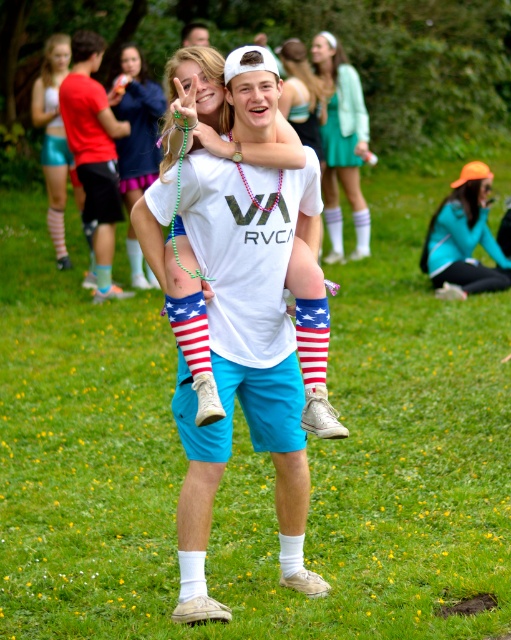
Question: Does white cotton t-shirt at center have a larger size compared to orange fabric hat at upper right?

Choices:
 (A) yes
 (B) no

Answer: (A)

Question: Which object is closer to the camera taking this photo?

Choices:
 (A) matte white t-shirt at center
 (B) white cotton t-shirt at center
 (C) shiny teal shorts at upper left
 (D) matte red shorts at upper left

Answer: (B)

Question: Is orange fabric hat at upper right bigger than matte white shirt at center?

Choices:
 (A) yes
 (B) no

Answer: (B)

Question: Which of the following is the farthest from the observer?

Choices:
 (A) (152, 128)
 (B) (114, 124)

Answer: (A)

Question: Does matte red shorts at upper left come in front of green textured dress at upper center?

Choices:
 (A) yes
 (B) no

Answer: (A)

Question: Which point appears farthest from the camera in this image?

Choices:
 (A) (198, 36)
 (B) (339, 76)

Answer: (A)